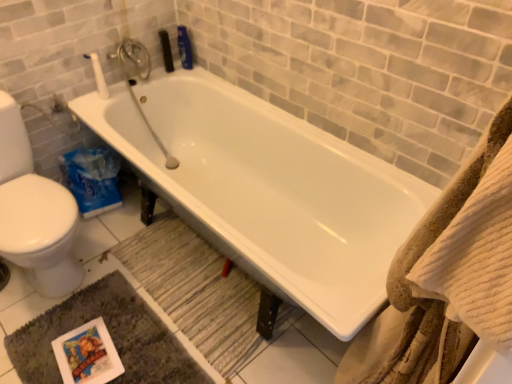
Identify the location of empty space that is ontop of dark gray plush bath mat at lower left, arranged as the first bath mat when ordered from the bottom (from a real-world perspective). (100, 342).